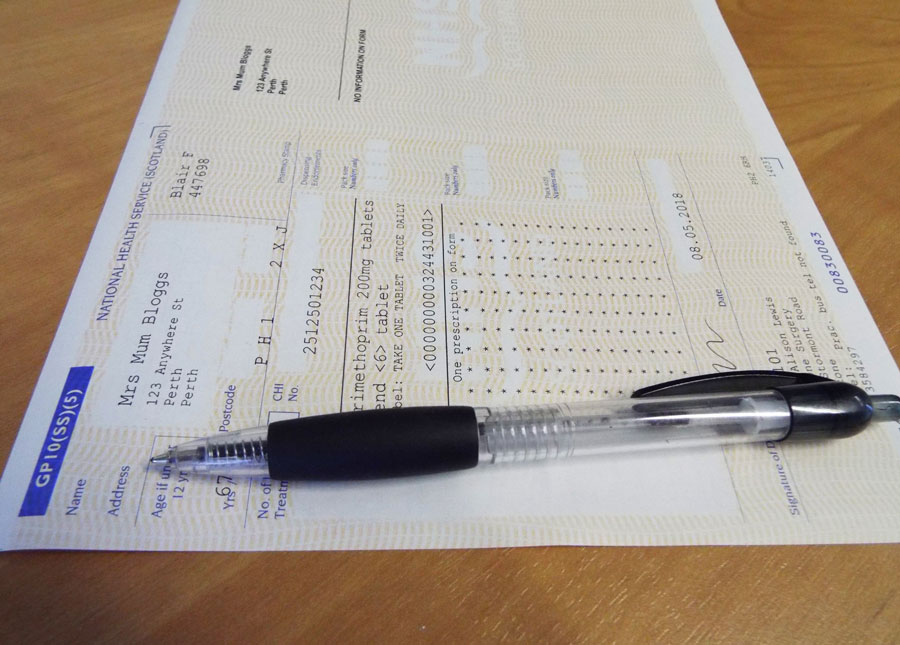
The image size is (900, 645). Identify the location of table. [x=73, y=92].